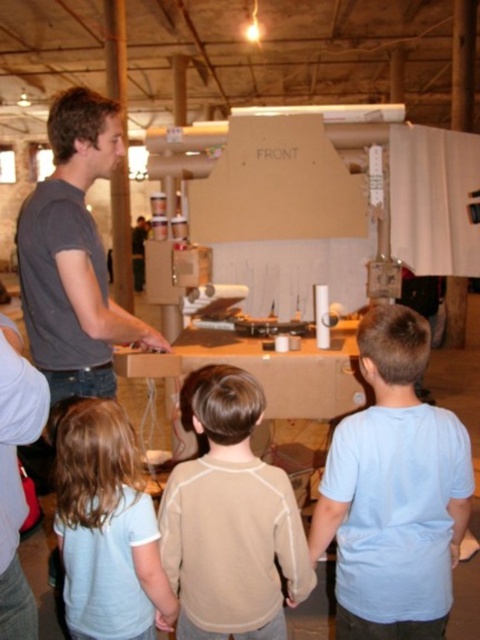
You are a photographer setting up for a group photo. You need to position the beige fleece sweater at center and the light blue shirt at lower left so that both are visible in the frame. Considering their heights, which one should be placed closer to the front to ensure both are visible?

The light blue shirt at lower left should be placed closer to the front since the beige fleece sweater at center is taller. This arrangement ensures that both the shorter and taller individuals are visible in the photo.

You are a photographer standing in the middle of the room, and you want to take a photo that includes both the point at (219,582) and the point at (115,483). Which point should you focus on first to ensure both are in sharp focus?

You should focus on the point at (219,582) first because it is closer to the camera than the point at (115,483). This ensures that the closer point is in focus, and the farther point will also be within the depth of field.

You are a photographer in this scene and want to capture both the light blue cotton shirt at center and the beige fleece sweater at center in a single frame. Which clothing item should you focus on first to ensure both are in the frame without moving the camera?

The light blue cotton shirt at center is smaller in size compared to the beige fleece sweater at center, so focusing on the smaller one first would help ensure both are captured in the frame.